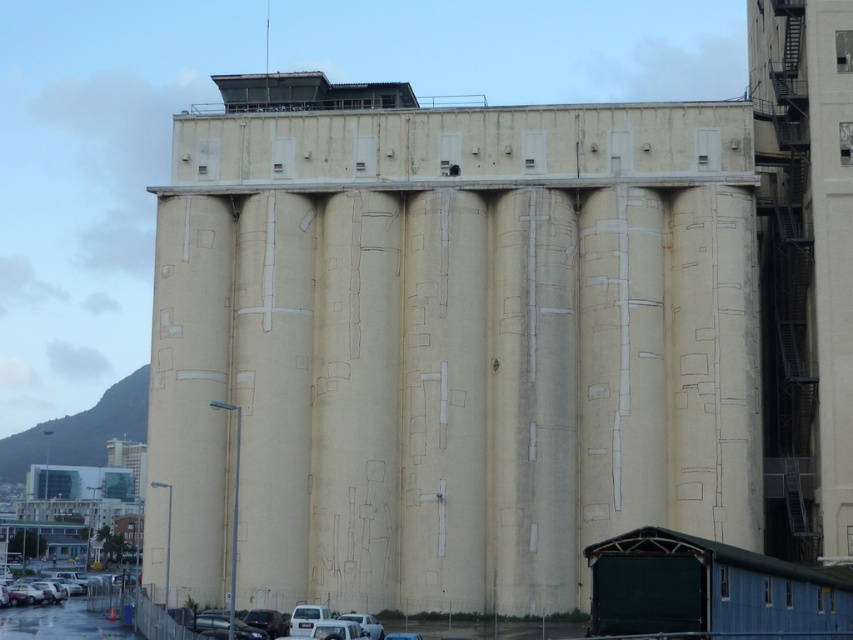
Question: Is beige concrete silo at center further to camera compared to silver metallic car at lower left?

Choices:
 (A) yes
 (B) no

Answer: (B)

Question: Among these objects, which one is nearest to the camera?

Choices:
 (A) beige concrete silo at center
 (B) silver metallic car at lower left

Answer: (A)

Question: Does beige concrete silo at center appear over silver metallic car at lower left?

Choices:
 (A) no
 (B) yes

Answer: (B)

Question: Is beige concrete silo at center wider than silver metallic car at lower left?

Choices:
 (A) yes
 (B) no

Answer: (A)

Question: Which point is closer to the camera?

Choices:
 (A) (94, 592)
 (B) (202, 234)

Answer: (B)